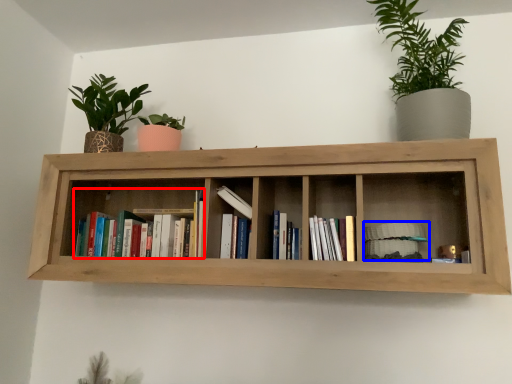
Question: Which object is further to the camera taking this photo, book (highlighted by a red box) or book (highlighted by a blue box)?

Choices:
 (A) book
 (B) book

Answer: (A)